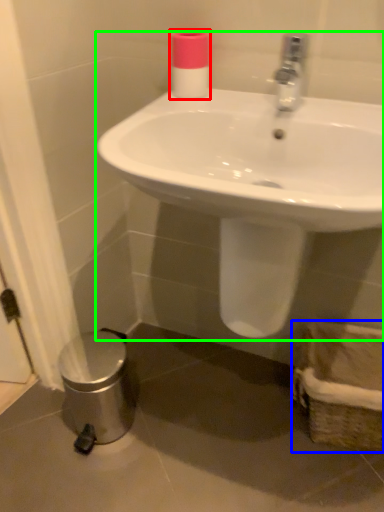
Question: Which object is the farthest from toiletry (highlighted by a red box)? Choose among these: basket (highlighted by a blue box) or sink (highlighted by a green box).

Choices:
 (A) basket
 (B) sink

Answer: (A)